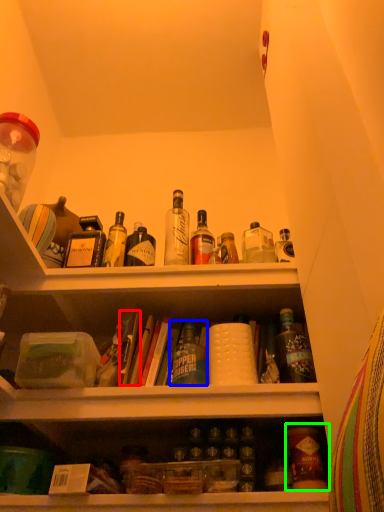
Question: Which object is positioned farthest from book (highlighted by a red box)? Select from bottle (highlighted by a blue box) and bottle (highlighted by a green box).

Choices:
 (A) bottle
 (B) bottle

Answer: (B)